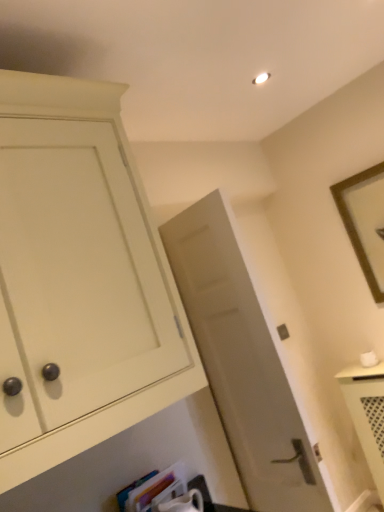
Question: Is there a large distance between matte white cabinet at left and matte gray door at center?

Choices:
 (A) no
 (B) yes

Answer: (A)

Question: From the image's perspective, would you say matte white cabinet at left is shown under matte gray door at center?

Choices:
 (A) yes
 (B) no

Answer: (B)

Question: From a real-world perspective, is matte white cabinet at left over matte gray door at center?

Choices:
 (A) yes
 (B) no

Answer: (A)

Question: Is matte white cabinet at left positioned beyond the bounds of matte gray door at center?

Choices:
 (A) no
 (B) yes

Answer: (B)

Question: Is matte white cabinet at left at the left side of matte gray door at center?

Choices:
 (A) yes
 (B) no

Answer: (A)

Question: Is matte gray door at center inside or outside of matte white cabinet at left?

Choices:
 (A) inside
 (B) outside

Answer: (B)

Question: Based on their positions, is matte gray door at center located to the left or right of matte white cabinet at left?

Choices:
 (A) right
 (B) left

Answer: (A)

Question: In terms of size, does matte gray door at center appear bigger or smaller than matte white cabinet at left?

Choices:
 (A) small
 (B) big

Answer: (A)

Question: From a real-world perspective, is matte gray door at center above or below matte white cabinet at left?

Choices:
 (A) below
 (B) above

Answer: (A)

Question: Looking at their shapes, would you say matte white cabinet at left is wider or thinner than hardcover book at lower center?

Choices:
 (A) wide
 (B) thin

Answer: (A)

Question: Choose the correct answer: Is matte white cabinet at left inside hardcover book at lower center or outside it?

Choices:
 (A) inside
 (B) outside

Answer: (B)

Question: Considering their positions, is matte white cabinet at left located in front of or behind hardcover book at lower center?

Choices:
 (A) behind
 (B) front

Answer: (B)

Question: In terms of size, does matte white cabinet at left appear bigger or smaller than hardcover book at lower center?

Choices:
 (A) small
 (B) big

Answer: (B)

Question: From a real-world perspective, is brown wooden picture frame at upper right positioned above or below hardcover book at lower center?

Choices:
 (A) below
 (B) above

Answer: (B)

Question: Is brown wooden picture frame at upper right in front of or behind hardcover book at lower center in the image?

Choices:
 (A) front
 (B) behind

Answer: (B)